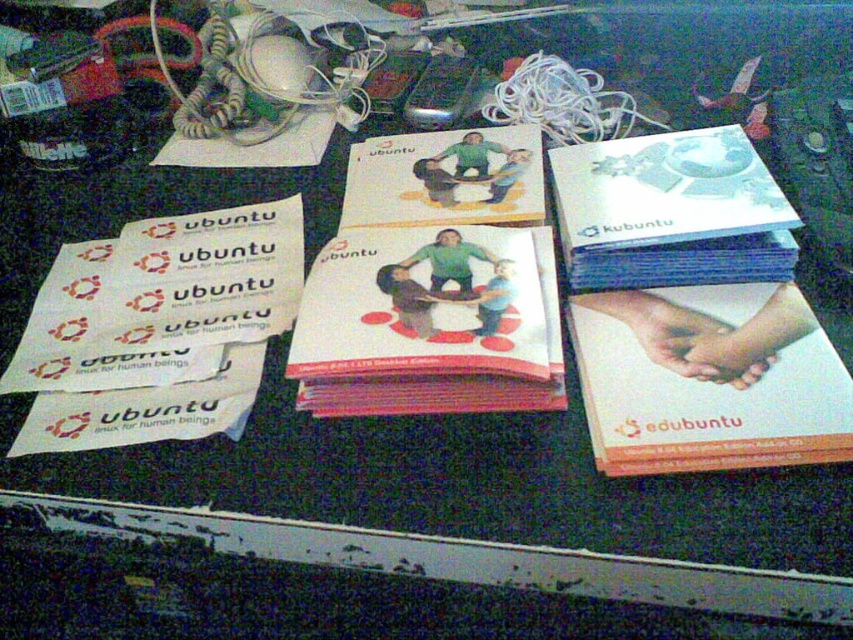
In the scene shown: Please provide the 2D coordinates of the white matte paper at center right in the image.

The 2D coordinates of the white matte paper at center right are at point (708,380).

You are organizing a tech conference and need to arrange promotional materials. You have a white matte paper at center right and a white glossy book at upper right. Which one should you place on the left side of your display to maintain proper alignment?

The white matte paper at center right should be placed on the left side of the display because it is already positioned to the left of the white glossy book at upper right in the original arrangement.

You are standing in front of the Ubuntu materials on the dark surface. You see two points labeled as point (x=776, y=403) and point (x=759, y=157). Which point is closer to you?

Point (x=776, y=403) is closer to you because it is in front of point (x=759, y=157).